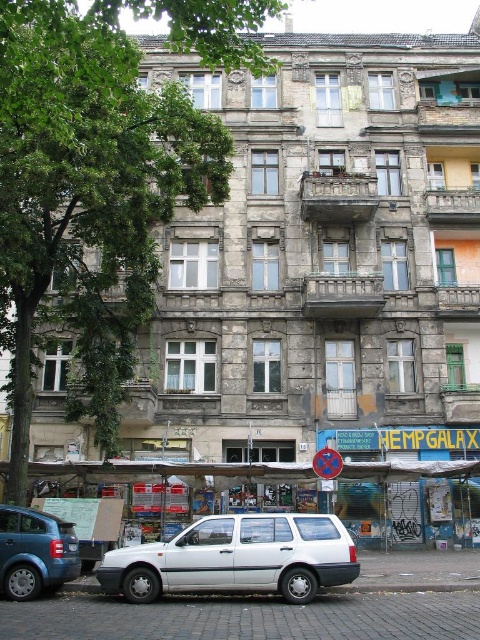
You are a delivery person trying to park your vehicle in the space between the white matte car at center and the white plastic license plate at center. Can you estimate whether there is enough space for your vehicle, which is 2 meters wide?

The white matte car at center is positioned on the right side of the white plastic license plate at center, so there is no space between them for your vehicle to park. You need to look for another parking spot.

You are a delivery person approaching the building and need to park your vehicle. You see the white matte car at center and the white plastic license plate at center. Which object is closer to you as you approach the building?

The white matte car at center is closer to the viewer than the white plastic license plate at center, so the white matte car at center is closer to you as you approach the building.

You are standing in front of the residential building and see the point marked as point (326, 464). What object does this point correspond to?

The point (326, 464) corresponds to the metallic reflective sign at center.